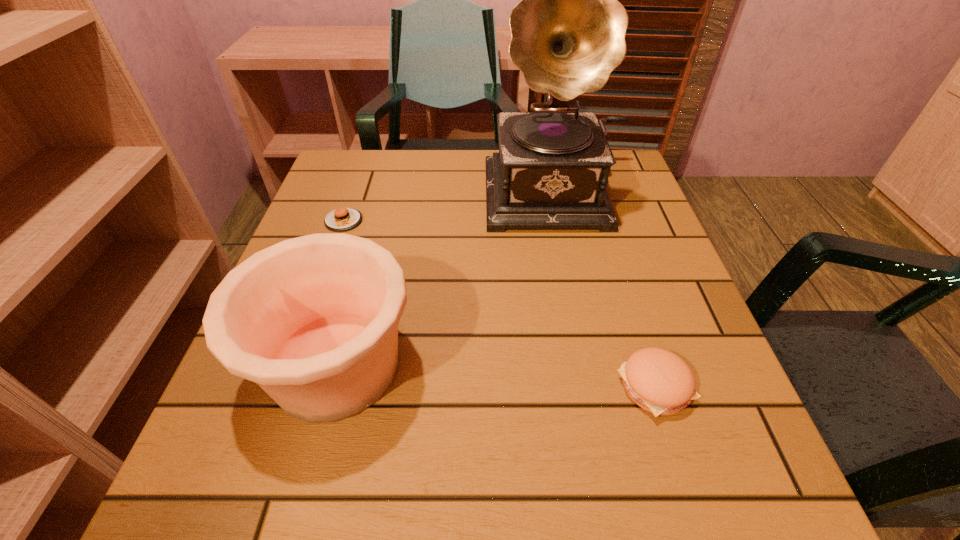
In the image, there is a desktop. At what (x,y) coordinates should I click in order to perform the action: click on vacant space at the far left corner. Please return your answer as a coordinate pair (x, y). The image size is (960, 540). Looking at the image, I should click on (344, 200).

Image resolution: width=960 pixels, height=540 pixels. In the image, there is a desktop. Identify the location of vacant space at the near right corner. (740, 472).

This screenshot has height=540, width=960. Identify the location of vacant space that's between the taller food and the pottery. click(495, 377).

Where is `free area in between the tallest object and the pottery`? This screenshot has height=540, width=960. free area in between the tallest object and the pottery is located at coordinates (447, 280).

I want to click on empty space between the right food and the pottery, so click(495, 377).

Where is `vacant space in between the nearer food and the shortest object`? The width and height of the screenshot is (960, 540). vacant space in between the nearer food and the shortest object is located at coordinates (499, 304).

You are a GUI agent. You are given a task and a screenshot of the screen. Output one action in this format:
    pyautogui.click(x=<x>, y=<y>)
    Task: Click on the vacant area between the second tallest object and the record player
    The image size is (960, 540).
    Given the screenshot: What is the action you would take?
    447,280

The image size is (960, 540). I want to click on empty space that is in between the third shortest object and the nearer food, so click(x=495, y=377).

Locate an element on the screen. empty space that is in between the taller food and the pottery is located at coordinates (495, 377).

This screenshot has width=960, height=540. Identify the location of vacant space that's between the tallest object and the right food. (607, 290).